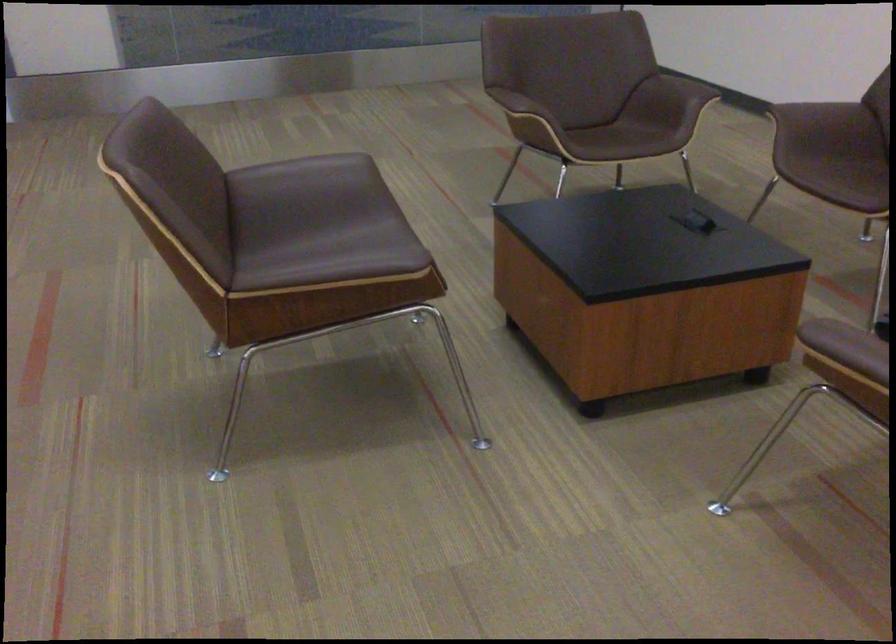
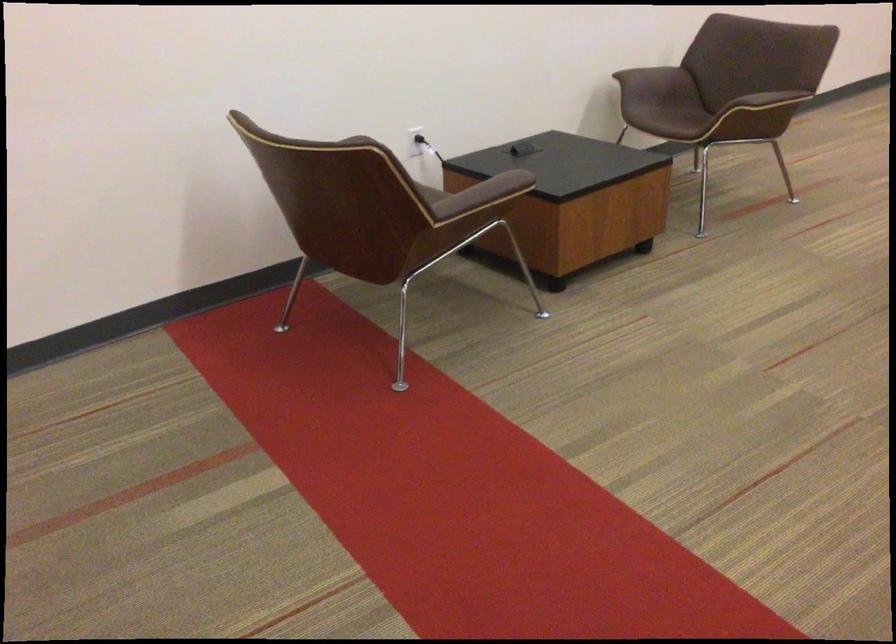
How did the camera likely rotate?

The camera rotated toward right-down.